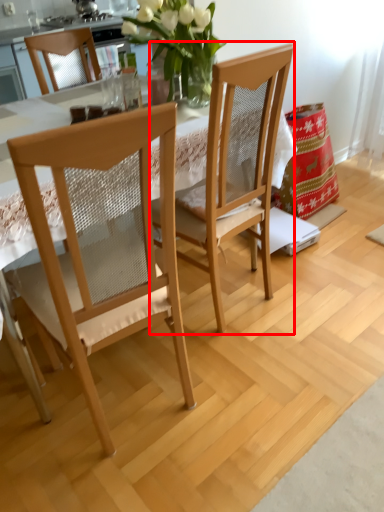
Question: From the image, what is the correct spatial relationship of chair (annotated by the red box) in relation to chair?

Choices:
 (A) right
 (B) left

Answer: (A)